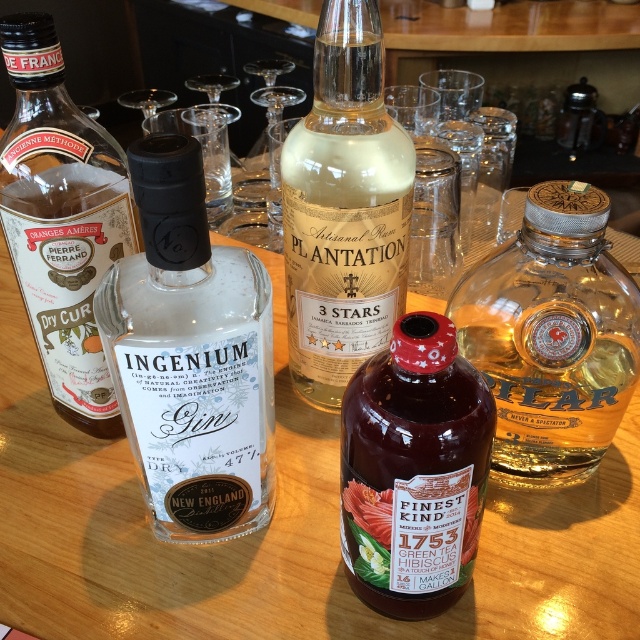
Question: Among these points, which one is nearest to the camera?

Choices:
 (A) (96, 184)
 (B) (227, 424)

Answer: (B)

Question: Which is nearer to the purple glass bottle at center?

Choices:
 (A) translucent glass bottle at center
 (B) clear glass gin at center
 (C) translucent glass bottle at right
 (D) clear glass bottle at left

Answer: (B)

Question: Does clear glass gin at center appear under translucent glass bottle at right?

Choices:
 (A) no
 (B) yes

Answer: (B)

Question: Which point is closer to the camera?

Choices:
 (A) clear glass gin at center
 (B) purple glass bottle at center
 (C) translucent glass bottle at center

Answer: (A)

Question: Can you confirm if clear glass gin at center is thinner than purple glass bottle at center?

Choices:
 (A) no
 (B) yes

Answer: (A)

Question: Can you confirm if clear glass gin at center is positioned below translucent glass bottle at center?

Choices:
 (A) yes
 (B) no

Answer: (A)